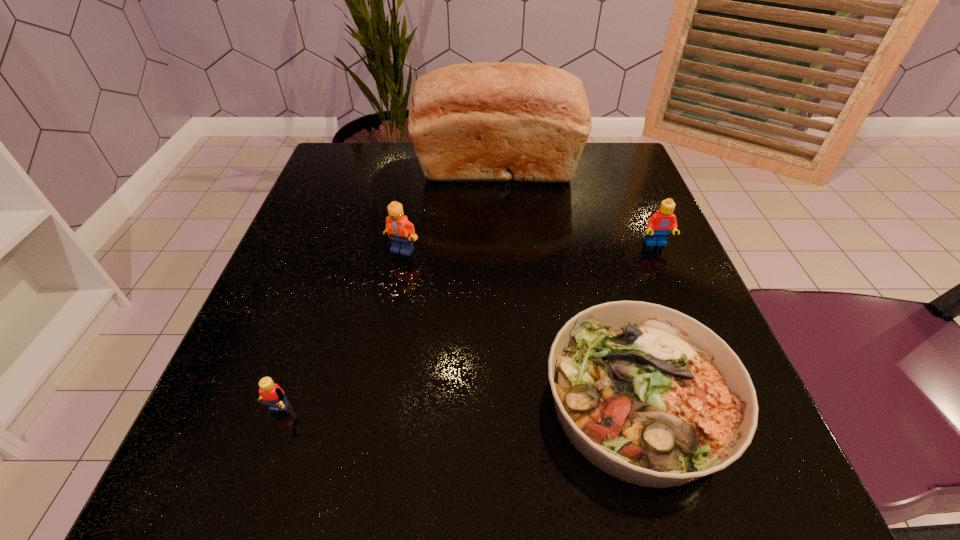
This screenshot has width=960, height=540. Identify the location of vacant position located on the front-facing side of the nearest Lego. (249, 497).

The height and width of the screenshot is (540, 960). In order to click on vacant area situated 0.100m on the back of the salad plate in this screenshot , I will do `click(603, 282)`.

Where is `object located in the far edge section of the desktop`? object located in the far edge section of the desktop is located at coordinates (483, 121).

Find the location of a particular element. Lego that is at the near edge is located at coordinates (272, 395).

Find the location of `salad plate present at the near edge`. salad plate present at the near edge is located at coordinates [x=649, y=395].

You are a GUI agent. You are given a task and a screenshot of the screen. Output one action in this format:
    pyautogui.click(x=<x>, y=<y>)
    Task: Click on the object located in the left edge section of the desktop
    The width and height of the screenshot is (960, 540).
    Given the screenshot: What is the action you would take?
    pyautogui.click(x=272, y=395)

Locate an element on the screen. bread located in the right edge section of the desktop is located at coordinates (483, 121).

You are a GUI agent. You are given a task and a screenshot of the screen. Output one action in this format:
    pyautogui.click(x=<x>, y=<y>)
    Task: Click on the Lego located in the right edge section of the desktop
    
    Given the screenshot: What is the action you would take?
    pyautogui.click(x=660, y=224)

Identify the location of salad plate located at the right edge. The width and height of the screenshot is (960, 540). (649, 395).

The height and width of the screenshot is (540, 960). I want to click on object positioned at the near left corner, so click(x=272, y=395).